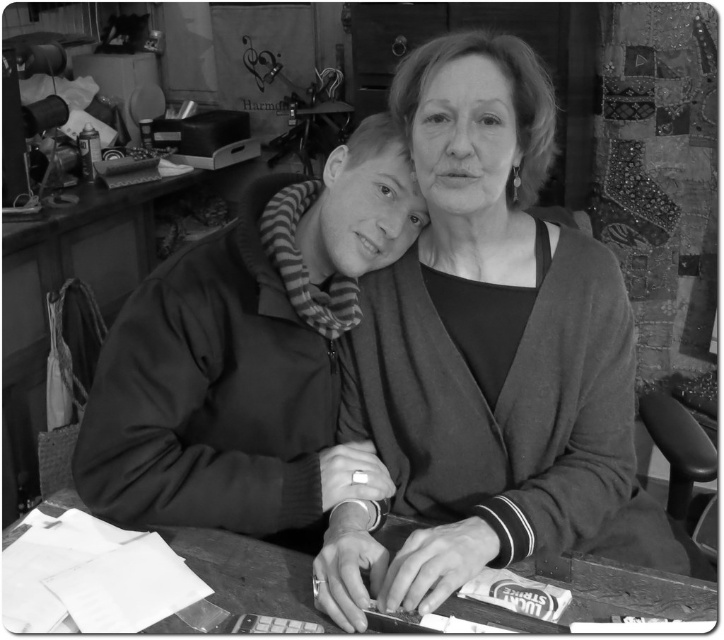
You are organizing a workshop and need to place a new decorative item on the wooden table at lower center. However, there is already a matte black jacket at center on it. What should you do to make space?

The matte black jacket at center is positioned over the wooden table at lower center. To make space, you should move the matte black jacket at center from the wooden table at lower center.

You are an interior designer who needs to place a new lamp on the table in the image. The lamp requires a space of 0.6 meters in diameter. Can the lamp be placed at the point indicated by point (x=487, y=356), which is the matte gray sweater at center?

The point (x=487, y=356) is where the matte gray sweater at center is located. Since the sweater occupies that space, placing the lamp there would not be possible as the sweater is already there.